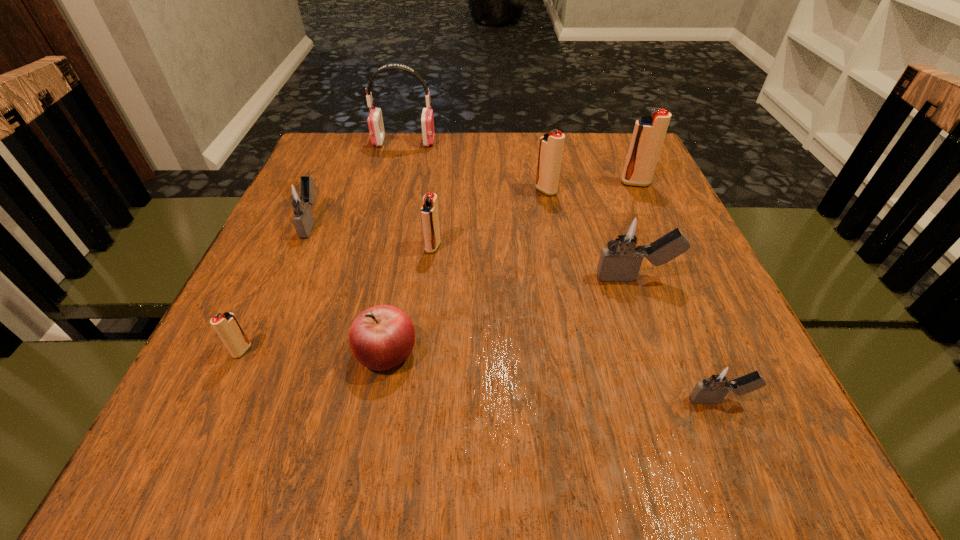
The height and width of the screenshot is (540, 960). Find the location of `vacant region that satisfies the following two spatial constraints: 1. on the outer surface of the earphone; 2. on the right side of the fourth farthest igniter`. vacant region that satisfies the following two spatial constraints: 1. on the outer surface of the earphone; 2. on the right side of the fourth farthest igniter is located at coordinates (378, 247).

You are a GUI agent. You are given a task and a screenshot of the screen. Output one action in this format:
    pyautogui.click(x=<x>, y=<y>)
    Task: Click on the free space that satisfies the following two spatial constraints: 1. on the back side of the apple; 2. on the right side of the second red igniter from right to left
    This screenshot has height=540, width=960.
    Given the screenshot: What is the action you would take?
    pyautogui.click(x=416, y=191)

Locate an element on the screen. free location that satisfies the following two spatial constraints: 1. on the back side of the rightmost red igniter; 2. on the right side of the biggest gray igniter is located at coordinates tap(602, 183).